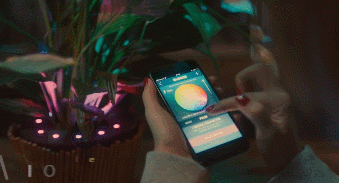
At what (x,y) coordinates should I click in order to perform the action: click on plant. Please return your answer as a coordinate pair (x, y). Looking at the image, I should click on (183, 73).